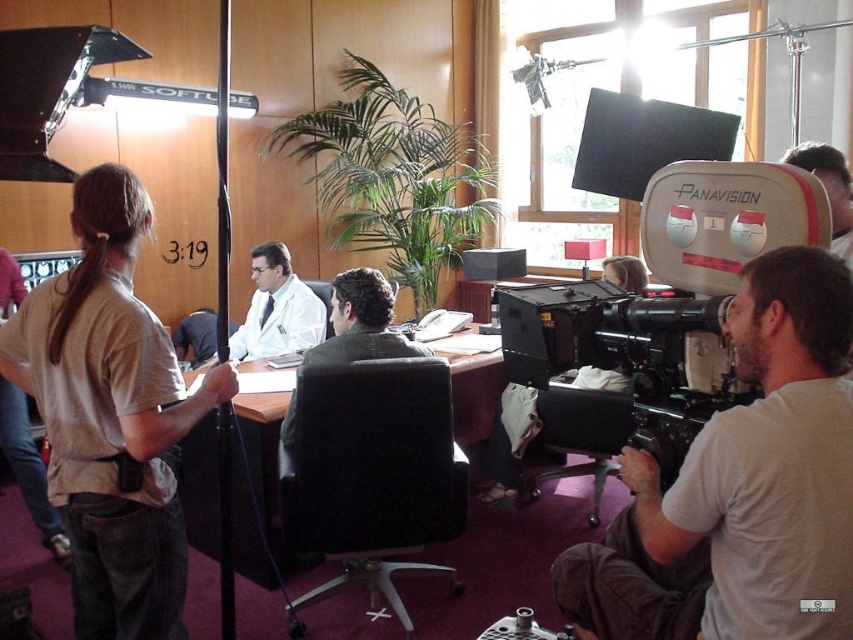
Question: Where is matte gray camera at right located in relation to matte black panavision camera at right in the image?

Choices:
 (A) below
 (B) above

Answer: (A)

Question: Is matte gray camera at right bigger than white matte coat at center?

Choices:
 (A) yes
 (B) no

Answer: (A)

Question: Which object is farther from the camera taking this photo?

Choices:
 (A) matte black panavision camera at right
 (B) matte gray camera at right
 (C) white matte coat at center

Answer: (C)

Question: Which point appears farthest from the camera in this image?

Choices:
 (A) (621, 476)
 (B) (674, 324)

Answer: (A)

Question: Which is nearer to the matte black panavision camera at right?

Choices:
 (A) white matte coat at center
 (B) matte gray camera at right

Answer: (B)

Question: Can you confirm if matte gray camera at right is bigger than white matte coat at center?

Choices:
 (A) yes
 (B) no

Answer: (A)